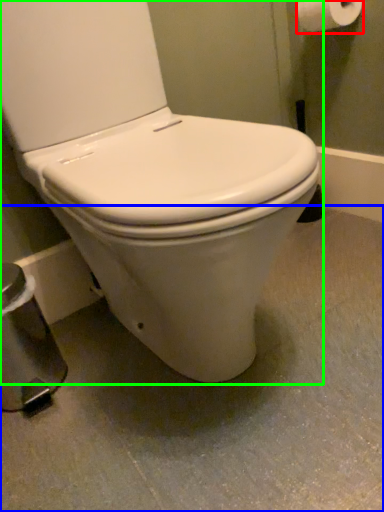
Question: Considering the real-world distances, which object is closest to toilet paper (highlighted by a red box)? concrete (highlighted by a blue box) or toilet (highlighted by a green box).

Choices:
 (A) concrete
 (B) toilet

Answer: (B)